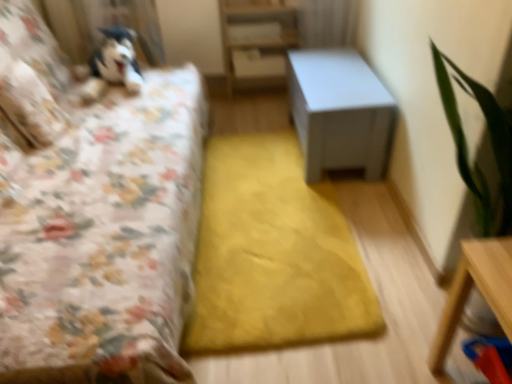
The height and width of the screenshot is (384, 512). I want to click on free location in front of white matte bookshelf at center, so click(259, 124).